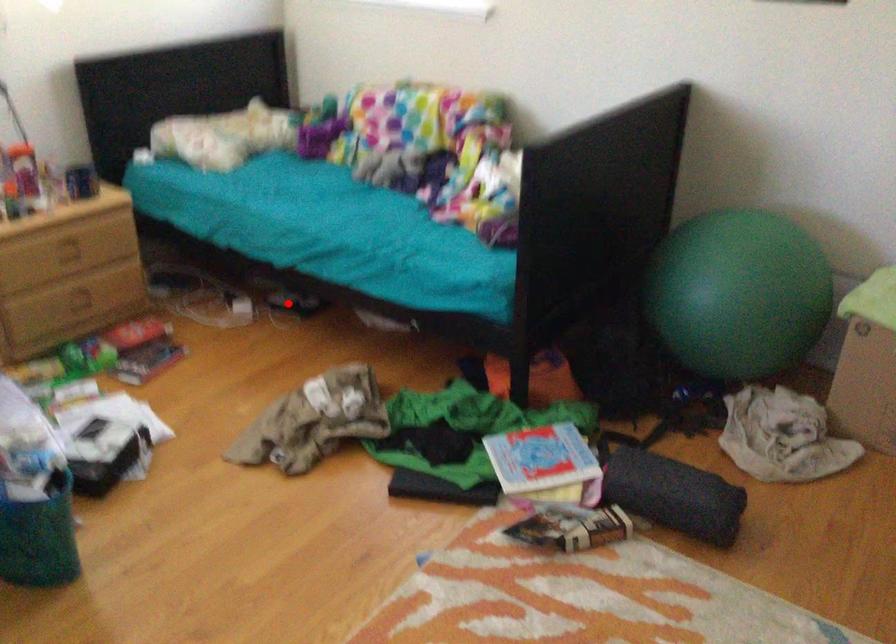
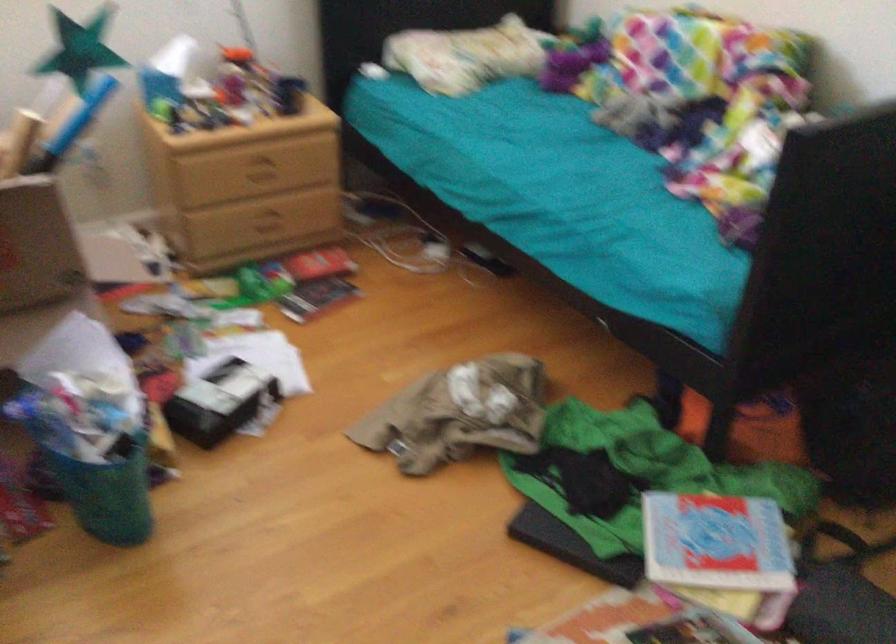
Where in the second image is the point corresponding to the highlighted location from the first image?

(481, 259)